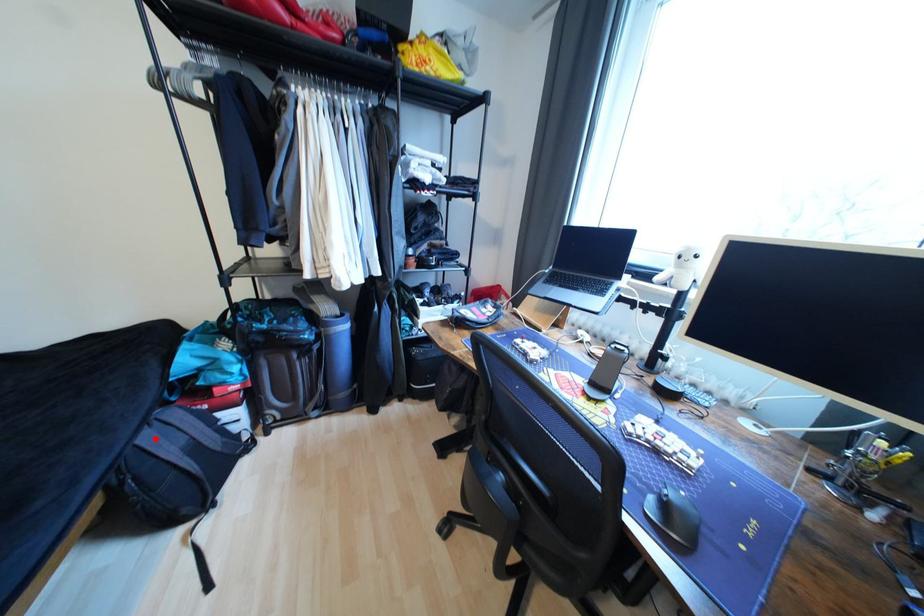
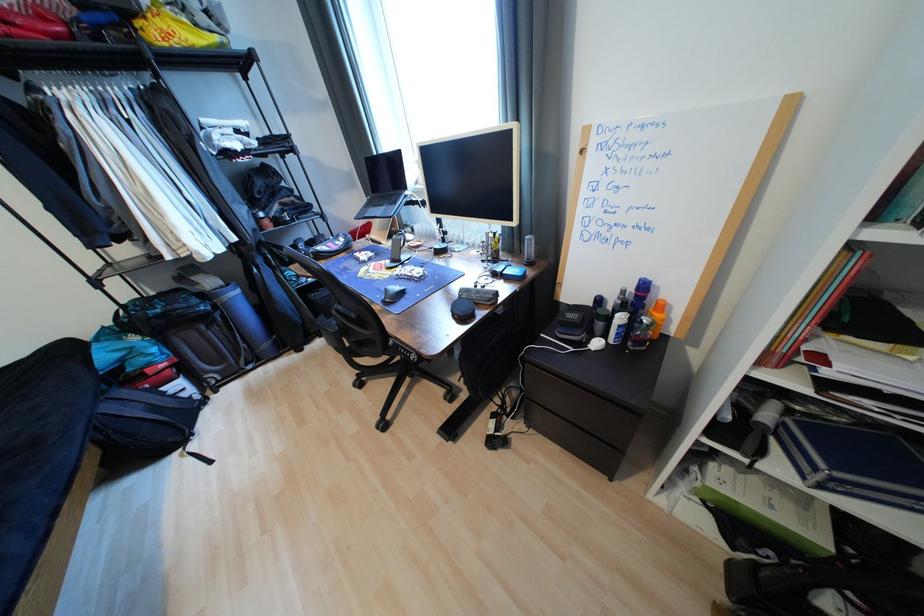
Where in the second image is the point corresponding to the highlighted location from the first image?

(116, 408)